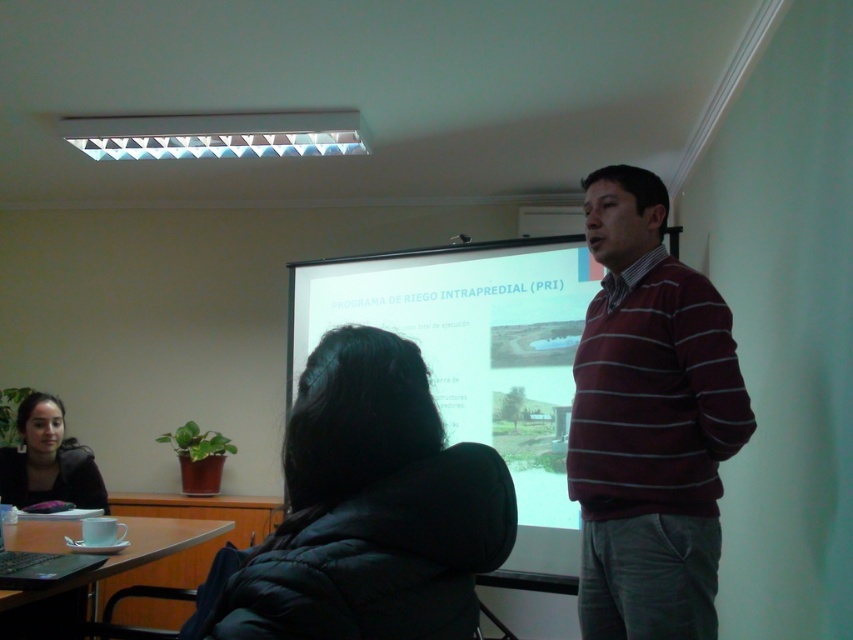
You are standing at the point marked as point (103, 506). You want to walk to the projection screen. The room is 12 feet long. How many steps will you need to take if each step is 2 feet long?

The distance between you and the projection screen is 9.70 feet. Since each step is 2 feet long, you will need to take approximately 5 steps to reach the screen.

You are an attendee at the presentation and want to take a photo of the white matte projection screen at center and the matte black jacket at lower left. Which object should you focus on first if you want to capture both in a single frame without moving the camera?

The white matte projection screen at center is above the matte black jacket at lower left, so you should focus on the white matte projection screen at center first to ensure both are in the frame.

You are an attendee at the presentation. You want to take a photo of the white matte projection screen at center without including the matte black jacket at lower left in the frame. Is the screen large enough to fill your camera view without the jacket?

The white matte projection screen at center is larger than the matte black jacket at lower left, so it can potentially fill the camera view without including the jacket if positioned correctly.